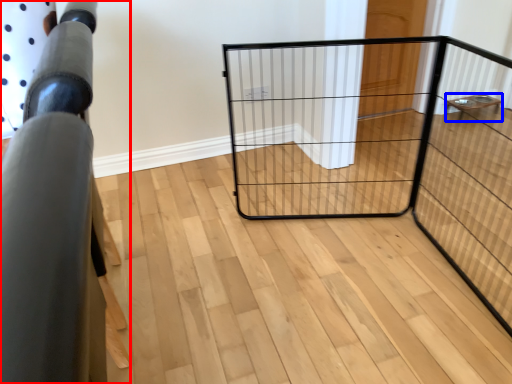
Question: Which object appears closest to the camera in this image, furniture (highlighted by a red box) or furniture (highlighted by a blue box)?

Choices:
 (A) furniture
 (B) furniture

Answer: (A)